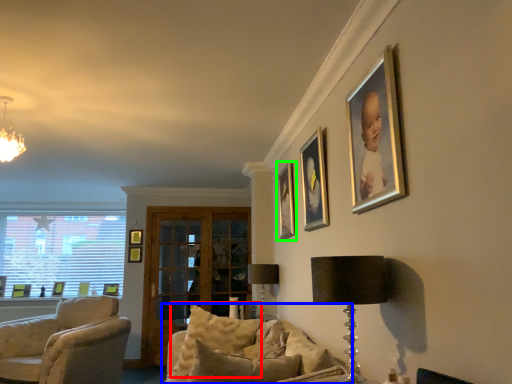
Question: Which object is the farthest from pillow (highlighted by a red box)? Choose among these: studio couch (highlighted by a blue box) or picture frame (highlighted by a green box).

Choices:
 (A) studio couch
 (B) picture frame

Answer: (B)